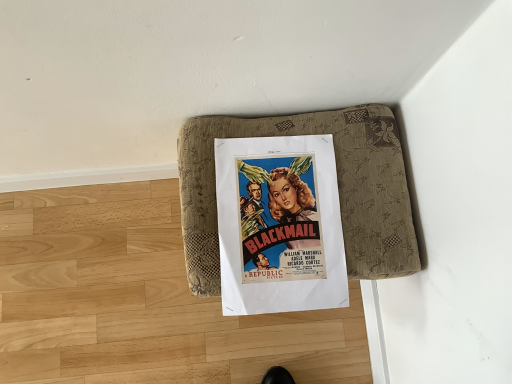
Locate an element on the screen. free space to the left of vibrant paper poster at center is located at coordinates (122, 248).